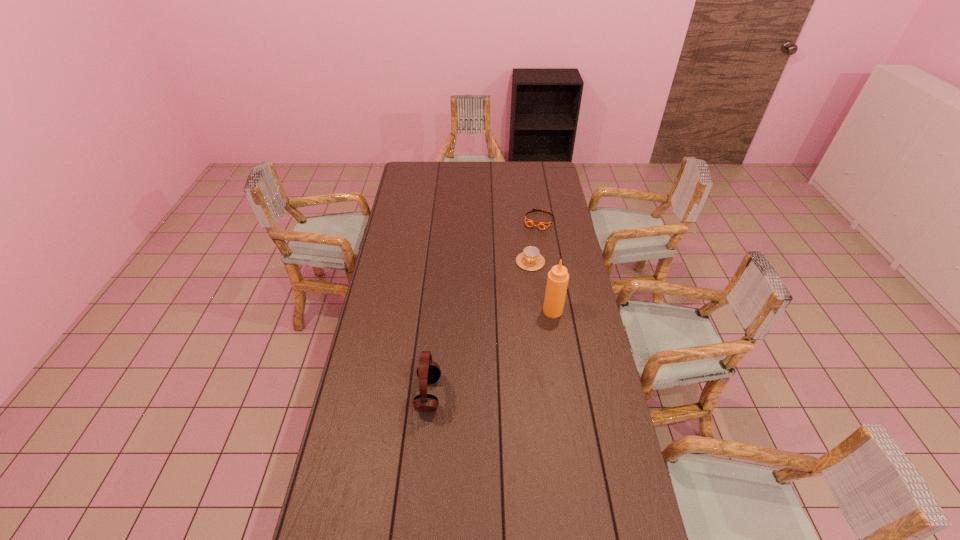
Locate an element on the screen. free space on the desktop that is between the nearest object and the condiment and is positioned with the lenses facing forward on the goggles is located at coordinates (477, 362).

Locate an element on the screen. This screenshot has height=540, width=960. vacant spot on the desktop that is between the nearest object and the tallest object and is positioned with the handle on the side of the cup is located at coordinates point(497,348).